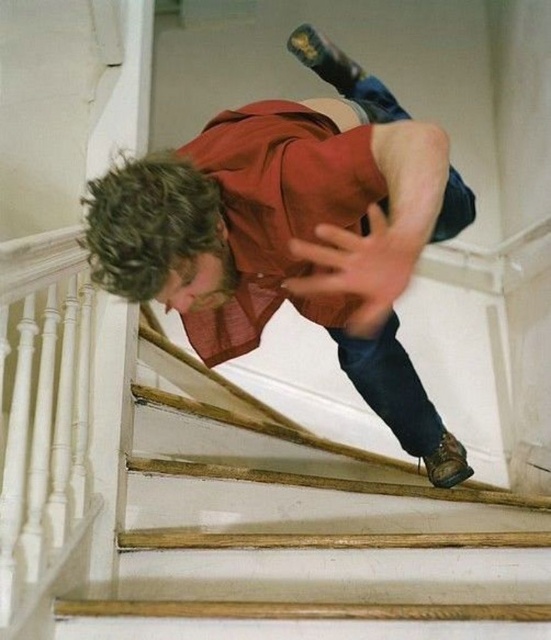
From the picture: Is wooden stairs at center below matte red shirt at center?

Correct, wooden stairs at center is located below matte red shirt at center.

Who is positioned more to the right, wooden stairs at center or matte red shirt at center?

wooden stairs at center

Which is in front, point (521, 625) or point (391, 396)?

Point (521, 625) is more forward.

At what (x,y) coordinates should I click in order to perform the action: click on wooden stairs at center. Please return your answer as a coordinate pair (x, y). The width and height of the screenshot is (551, 640). Looking at the image, I should click on (305, 541).